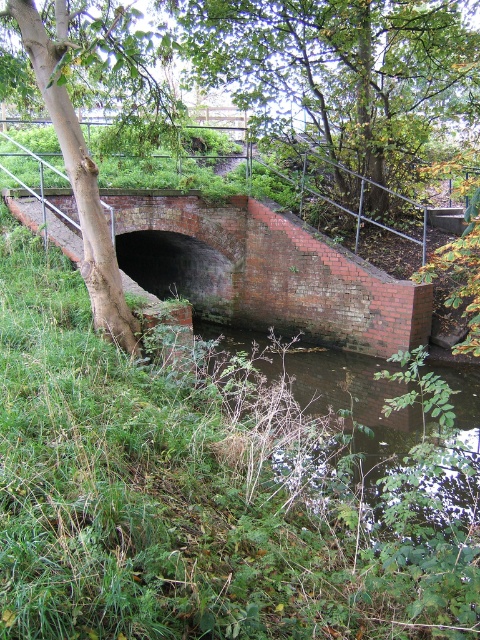
You are a hiker who wants to walk through the tunnel. You notice the brick at center and the green rough bark tree at left. Which object is closer to you as you approach the tunnel entrance?

The brick at center is closer to you than the green rough bark tree at left because it is further to the viewer.

You are a hiker with a 5 meter long rope. You want to tie the rope between the brick at center and the green rough bark tree at left to cross over a small stream. Will the rope be long enough?

The distance between the brick at center and the green rough bark tree at left is 6.16 meters. Since the rope is only 5 meters long, it will not be long enough to span the gap between them.